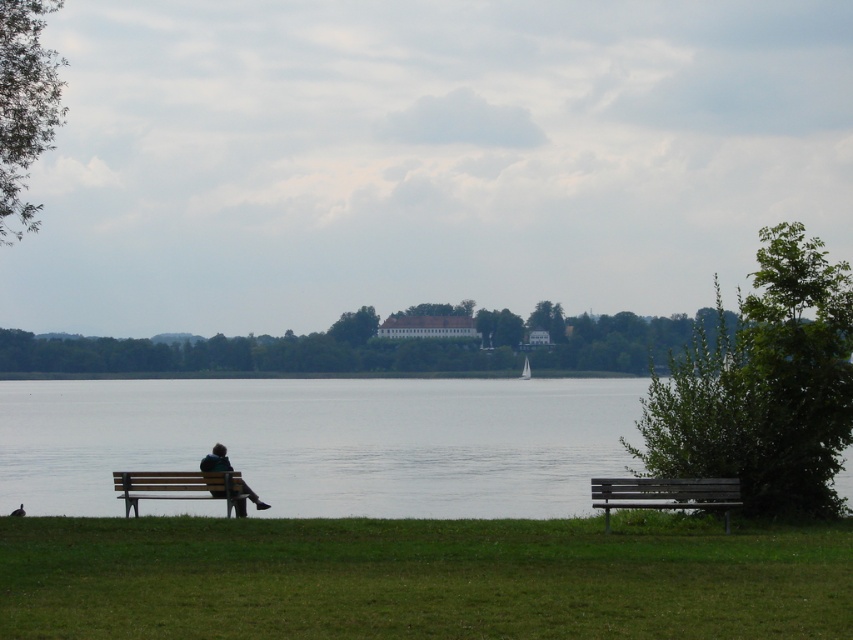
Question: Is wooden bench at lower right to the right of blue denim jacket at lower left from the viewer's perspective?

Choices:
 (A) yes
 (B) no

Answer: (A)

Question: Which of the following is the closest to the observer?

Choices:
 (A) blue denim jacket at lower left
 (B) wooden bench at lower left

Answer: (B)

Question: Estimate the real-world distances between objects in this image. Which object is farther from the wooden bench at lower right?

Choices:
 (A) blue denim jacket at lower left
 (B) wooden bench at lower left

Answer: (B)

Question: Which point appears farthest from the camera in this image?

Choices:
 (A) (173, 483)
 (B) (601, 477)
 (C) (444, 433)

Answer: (C)

Question: Can you confirm if wooden bench at lower right is wider than blue denim jacket at lower left?

Choices:
 (A) no
 (B) yes

Answer: (A)

Question: Does transparent water at lower center appear on the left side of wooden bench at lower left?

Choices:
 (A) yes
 (B) no

Answer: (A)